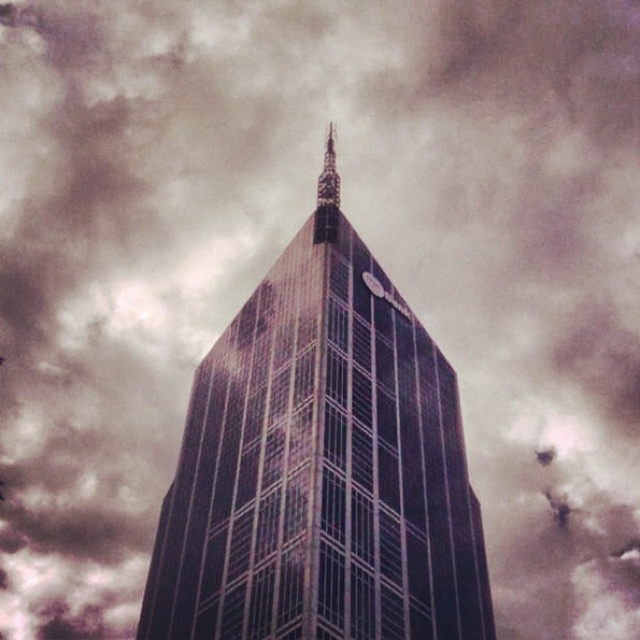
Question: Is shiny glass tower at center wider than polished glass spire at center?

Choices:
 (A) no
 (B) yes

Answer: (B)

Question: Which object appears farthest from the camera in this image?

Choices:
 (A) shiny glass tower at center
 (B) polished glass spire at center

Answer: (B)

Question: Is shiny glass tower at center bigger than polished glass spire at center?

Choices:
 (A) no
 (B) yes

Answer: (B)

Question: Does shiny glass tower at center have a larger size compared to polished glass spire at center?

Choices:
 (A) yes
 (B) no

Answer: (A)